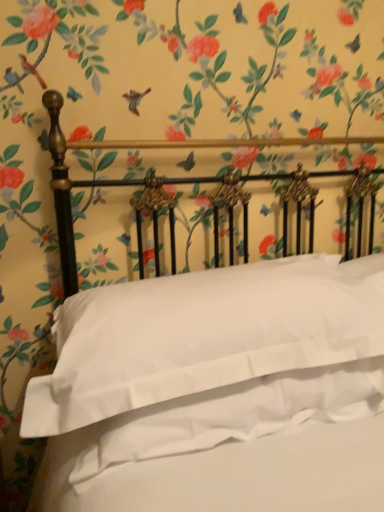
What do you see at coordinates (237, 414) in the screenshot? The image size is (384, 512). I see `white satin sheet at center` at bounding box center [237, 414].

Locate an element on the screen. The image size is (384, 512). white satin sheet at center is located at coordinates (237, 414).

What do you see at coordinates (204, 335) in the screenshot? The image size is (384, 512). I see `white smooth pillow at center` at bounding box center [204, 335].

In order to face white smooth pillow at center, should I rotate leftwards or rightwards?

Rotate right and turn 4.372 degrees.

Where is `white smooth pillow at center`? This screenshot has width=384, height=512. white smooth pillow at center is located at coordinates [204, 335].

I want to click on white satin sheet at center, so click(x=237, y=414).

Which is more to the right, white smooth pillow at center or white satin sheet at center?

white satin sheet at center is more to the right.

Is white smooth pillow at center positioned behind white satin sheet at center?

No, it is not.

Between point (101, 370) and point (331, 408), which one is positioned behind?

The point (331, 408) is behind.

From the image's perspective, which is below, white smooth pillow at center or white satin sheet at center?

white satin sheet at center is shown below in the image.

From a real-world perspective, between white smooth pillow at center and white satin sheet at center, who is vertically higher?

In real-world perspective, white smooth pillow at center is above.

Considering the sizes of objects white smooth pillow at center and white satin sheet at center in the image provided, who is thinner, white smooth pillow at center or white satin sheet at center?

white satin sheet at center.

Considering the sizes of objects white smooth pillow at center and white satin sheet at center in the image provided, who is shorter, white smooth pillow at center or white satin sheet at center?

Standing shorter between the two is white satin sheet at center.

Who is smaller, white smooth pillow at center or white satin sheet at center?

With smaller size is white satin sheet at center.

Could white satin sheet at center be considered to be inside white smooth pillow at center?

Yes, white satin sheet at center is a part of white smooth pillow at center.

Is white smooth pillow at center far away from white satin sheet at center?

No, white smooth pillow at center is in close proximity to white satin sheet at center.

Is white smooth pillow at center turned away from white satin sheet at center?

No, white smooth pillow at center is not facing the opposite direction of white satin sheet at center.

Locate an element on the screen. sheet located behind the white smooth pillow at center is located at coordinates (237, 414).

Does white satin sheet at center appear on the right side of white smooth pillow at center?

Yes, white satin sheet at center is to the right of white smooth pillow at center.

Looking at this image, which is in front, white satin sheet at center or white smooth pillow at center?

white smooth pillow at center is more forward.

Which is closer, (113, 431) or (132, 315)?

The point (113, 431) is closer to the camera.

From the image's perspective, is white satin sheet at center under white smooth pillow at center?

Indeed, from the image's perspective, white satin sheet at center is shown beneath white smooth pillow at center.

From a real-world perspective, who is located lower, white satin sheet at center or white smooth pillow at center?

white satin sheet at center, from a real-world perspective.

Considering the sizes of objects white satin sheet at center and white smooth pillow at center in the image provided, who is thinner, white satin sheet at center or white smooth pillow at center?

Thinner between the two is white satin sheet at center.

Considering the sizes of objects white satin sheet at center and white smooth pillow at center in the image provided, who is taller, white satin sheet at center or white smooth pillow at center?

white smooth pillow at center.

Based on their sizes in the image, would you say white satin sheet at center is bigger or smaller than white smooth pillow at center?

Clearly, white satin sheet at center is smaller in size than white smooth pillow at center.

Is white satin sheet at center not inside white smooth pillow at center?

Actually, white satin sheet at center is at least partially inside white smooth pillow at center.

Is white satin sheet at center beside white smooth pillow at center?

No, white satin sheet at center is not in contact with white smooth pillow at center.

Is white satin sheet at center facing towards white smooth pillow at center?

Yes, white satin sheet at center is facing white smooth pillow at center.

Image resolution: width=384 pixels, height=512 pixels. Find the location of `sheet located below the white smooth pillow at center (from the image's perspective)`. sheet located below the white smooth pillow at center (from the image's perspective) is located at coordinates (237, 414).

At what (x,y) coordinates should I click in order to perform the action: click on pillow above the white satin sheet at center (from the image's perspective). Please return your answer as a coordinate pair (x, y). This screenshot has width=384, height=512. Looking at the image, I should click on [x=204, y=335].

Identify the location of sheet located on the right of white smooth pillow at center. The width and height of the screenshot is (384, 512). click(x=237, y=414).